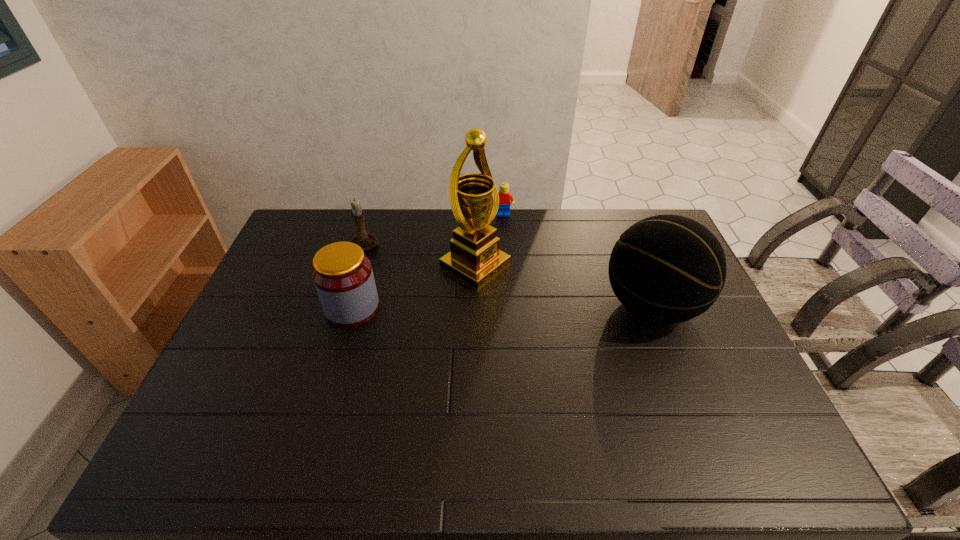
Find the location of `free spot between the award and the basketball`. free spot between the award and the basketball is located at coordinates (564, 286).

In order to click on free space between the candle holder and the shortest object in this screenshot , I will do `click(435, 230)`.

Where is `unoccupied position between the jar and the shortest object`? unoccupied position between the jar and the shortest object is located at coordinates (428, 261).

Locate an element on the screen. The image size is (960, 540). unoccupied area between the farthest object and the basketball is located at coordinates (577, 260).

This screenshot has height=540, width=960. In order to click on the second closest object relative to the candle holder in this screenshot , I will do (x=474, y=258).

Locate an element on the screen. The image size is (960, 540). object identified as the third closest to the shortest object is located at coordinates (366, 240).

The height and width of the screenshot is (540, 960). I want to click on vacant space that satisfies the following two spatial constraints: 1. on the back side of the candle holder; 2. on the right side of the farthest object, so click(375, 214).

At what (x,y) coordinates should I click in order to perform the action: click on vacant space that satisfies the following two spatial constraints: 1. on the back side of the basketball; 2. on the right side of the jar. Please return your answer as a coordinate pair (x, y). This screenshot has height=540, width=960. Looking at the image, I should click on (353, 306).

I want to click on blank area in the image that satisfies the following two spatial constraints: 1. on the front side of the award; 2. on the right side of the candle holder, so click(360, 266).

Locate an element on the screen. Image resolution: width=960 pixels, height=540 pixels. vacant space that satisfies the following two spatial constraints: 1. on the front side of the award; 2. on the left side of the rightmost object is located at coordinates (474, 306).